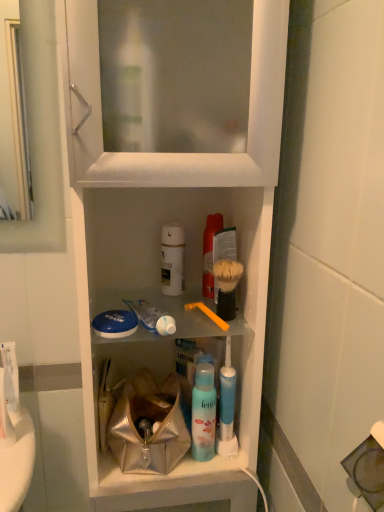
Question: Is orange plastic toothbrush at center to the left of bristled plastic shaving brush at center-right from the viewer's perspective?

Choices:
 (A) yes
 (B) no

Answer: (A)

Question: Does orange plastic toothbrush at center lie in front of bristled plastic shaving brush at center-right?

Choices:
 (A) yes
 (B) no

Answer: (A)

Question: From the image's perspective, does orange plastic toothbrush at center appear higher than bristled plastic shaving brush at center-right?

Choices:
 (A) yes
 (B) no

Answer: (B)

Question: Is orange plastic toothbrush at center aimed at bristled plastic shaving brush at center-right?

Choices:
 (A) yes
 (B) no

Answer: (B)

Question: Can you confirm if orange plastic toothbrush at center is bigger than bristled plastic shaving brush at center-right?

Choices:
 (A) no
 (B) yes

Answer: (A)

Question: From the image's perspective, is orange plastic toothbrush at center beneath bristled plastic shaving brush at center-right?

Choices:
 (A) no
 (B) yes

Answer: (B)

Question: Is metallic silver bag at center taller than white plastic cabinet at center?

Choices:
 (A) no
 (B) yes

Answer: (A)

Question: Is metallic silver bag at center closer to camera compared to white plastic cabinet at center?

Choices:
 (A) yes
 (B) no

Answer: (B)

Question: Considering the relative positions of metallic silver bag at center and white plastic cabinet at center in the image provided, is metallic silver bag at center to the right of white plastic cabinet at center from the viewer's perspective?

Choices:
 (A) no
 (B) yes

Answer: (A)

Question: Is metallic silver bag at center outside white plastic cabinet at center?

Choices:
 (A) yes
 (B) no

Answer: (B)

Question: Is metallic silver bag at center thinner than white plastic cabinet at center?

Choices:
 (A) no
 (B) yes

Answer: (B)

Question: From the image's perspective, is metallic silver bag at center on top of white plastic cabinet at center?

Choices:
 (A) no
 (B) yes

Answer: (A)

Question: Is white plastic cabinet at center surrounding white glossy toothpaste at center?

Choices:
 (A) no
 (B) yes

Answer: (B)